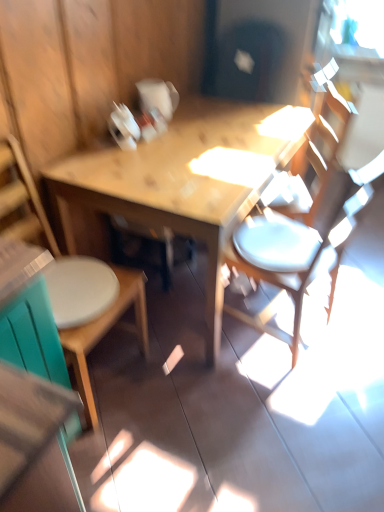
Question: Considering the positions of wooden table at center and white matte chair at right, which ranks as the 2th chair in left-to-right order, in the image, is wooden table at center wider or thinner than white matte chair at right, which ranks as the 2th chair in left-to-right order,?

Choices:
 (A) thin
 (B) wide

Answer: (B)

Question: From a real-world perspective, is wooden table at center physically located above or below white matte chair at right, placed as the 1th chair when sorted from right to left?

Choices:
 (A) below
 (B) above

Answer: (A)

Question: Estimate the real-world distances between objects in this image. Which object is closer to the white matte chair at right, which ranks as the 2th chair in left-to-right order?

Choices:
 (A) wooden chair at left, which is counted as the first chair, starting from the left
 (B) wooden table at center

Answer: (B)

Question: Which object is the farthest from the wooden chair at left, the second chair when ordered from right to left?

Choices:
 (A) white matte chair at right, placed as the 1th chair when sorted from right to left
 (B) wooden table at center

Answer: (A)